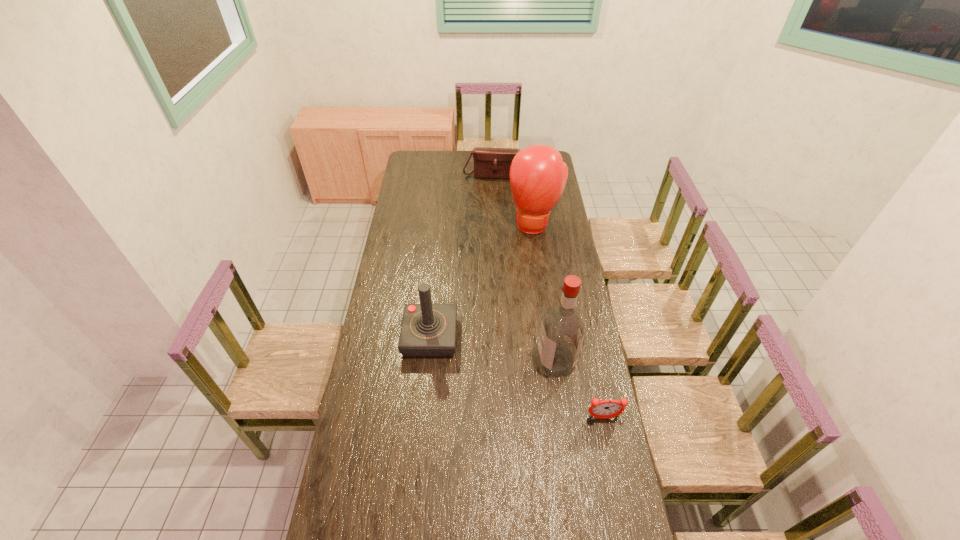
Image resolution: width=960 pixels, height=540 pixels. Find the location of `vacant space situated on the striking surface of the fourth nearest object`. vacant space situated on the striking surface of the fourth nearest object is located at coordinates (529, 292).

Locate an element on the screen. vacant space located 0.150m on the striking surface of the fourth nearest object is located at coordinates click(532, 261).

The height and width of the screenshot is (540, 960). What are the coordinates of `free space located 0.370m on the front-facing side of the liquor` in the screenshot? It's located at (444, 372).

I want to click on free location located 0.110m on the front-facing side of the liquor, so click(x=511, y=365).

The height and width of the screenshot is (540, 960). I want to click on vacant region located 0.350m on the front-facing side of the liquor, so click(x=450, y=371).

What are the coordinates of `free space located 0.400m on the front flap of the fourth tallest object` in the screenshot? It's located at (494, 223).

You are a GUI agent. You are given a task and a screenshot of the screen. Output one action in this format:
    pyautogui.click(x=<x>, y=<y>)
    Task: Click on the free space located on the front flap of the fourth tallest object
    This screenshot has width=960, height=540.
    Given the screenshot: What is the action you would take?
    pyautogui.click(x=494, y=188)

Image resolution: width=960 pixels, height=540 pixels. I want to click on vacant space located on the front flap of the fourth tallest object, so click(x=494, y=208).

Where is `object that is at the far edge`? This screenshot has height=540, width=960. object that is at the far edge is located at coordinates (495, 163).

This screenshot has width=960, height=540. What are the coordinates of `object that is at the left edge` in the screenshot? It's located at (428, 330).